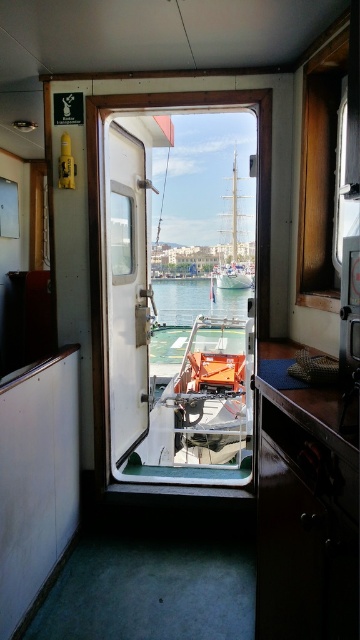
Question: Which object is the farthest from the polished silver sailboat at center?

Choices:
 (A) white glossy door at center
 (B) clear blue water at center
 (C) transparent glass window at center

Answer: (A)

Question: Is white glossy door at center above polished silver sailboat at center?

Choices:
 (A) no
 (B) yes

Answer: (A)

Question: Which of the following is the farthest from the observer?

Choices:
 (A) transparent glass window at center
 (B) clear blue water at center
 (C) white glossy door at center
 (D) polished silver sailboat at center

Answer: (D)

Question: Among these objects, which one is farthest from the camera?

Choices:
 (A) white glossy door at center
 (B) transparent glass window at center
 (C) polished silver sailboat at center
 (D) clear blue water at center

Answer: (C)

Question: Is clear blue water at center below polished silver sailboat at center?

Choices:
 (A) yes
 (B) no

Answer: (A)

Question: Does clear blue water at center lie behind polished silver sailboat at center?

Choices:
 (A) no
 (B) yes

Answer: (A)